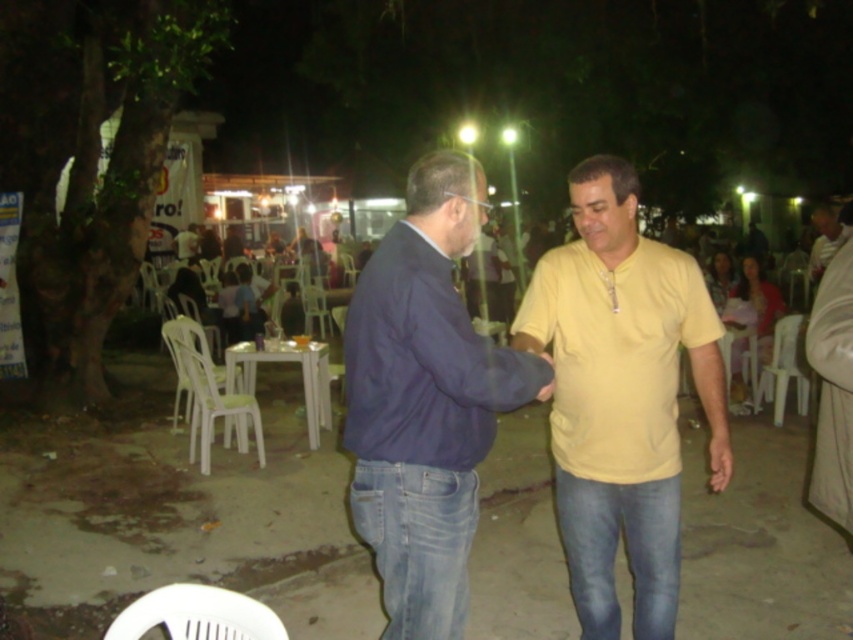
Question: Can you confirm if yellow matte shirt at center is positioned to the left of dark blue cotton shirt at center?

Choices:
 (A) yes
 (B) no

Answer: (B)

Question: Which of the following is the closest to the observer?

Choices:
 (A) (718, 362)
 (B) (358, 381)

Answer: (B)

Question: Is yellow matte shirt at center behind dark blue cotton shirt at center?

Choices:
 (A) no
 (B) yes

Answer: (B)

Question: Is yellow matte shirt at center bigger than dark blue cotton shirt at center?

Choices:
 (A) yes
 (B) no

Answer: (A)